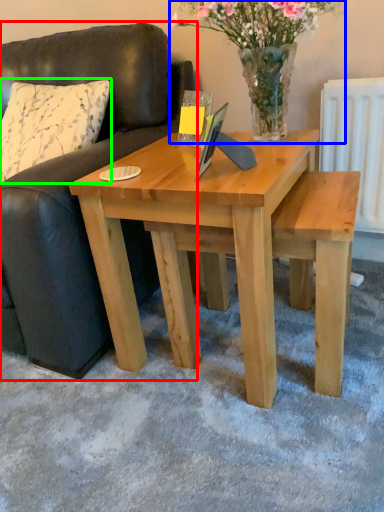
Question: Which object is the closest to the studio couch (highlighted by a red box)? Choose among these: floral arrangement (highlighted by a blue box) or pillow (highlighted by a green box).

Choices:
 (A) floral arrangement
 (B) pillow

Answer: (B)